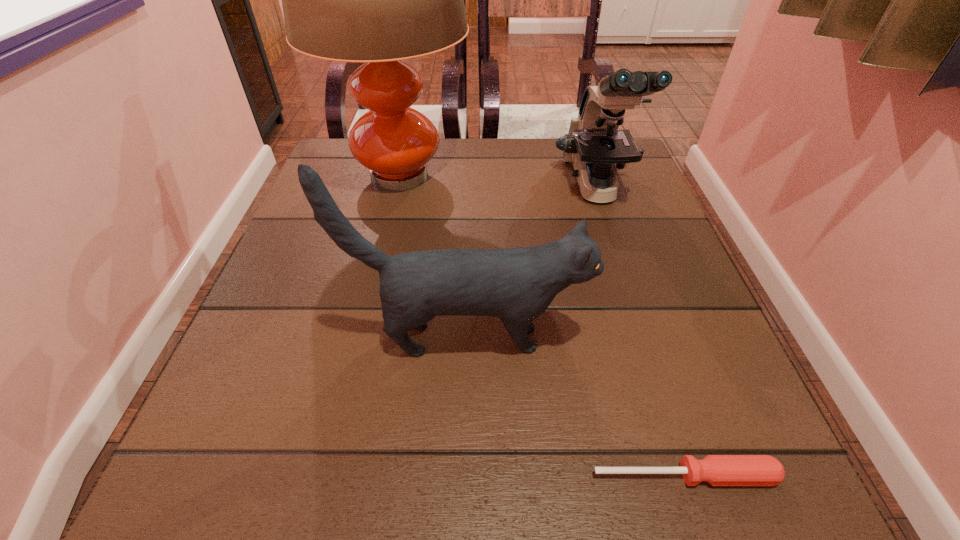
Where is `free space at the right edge of the desktop`? The image size is (960, 540). free space at the right edge of the desktop is located at coordinates (701, 338).

You are a GUI agent. You are given a task and a screenshot of the screen. Output one action in this format:
    pyautogui.click(x=<x>, y=<y>)
    Task: Click on the vacant area that lies between the shortest object and the microscope
    The width and height of the screenshot is (960, 540).
    Given the screenshot: What is the action you would take?
    pyautogui.click(x=640, y=332)

Locate an element on the screen. The width and height of the screenshot is (960, 540). vacant region between the microscope and the nearest object is located at coordinates point(640,332).

You are a GUI agent. You are given a task and a screenshot of the screen. Output one action in this format:
    pyautogui.click(x=<x>, y=<y>)
    Task: Click on the unoccupied position between the lamp and the shortest object
    The width and height of the screenshot is (960, 540).
    Given the screenshot: What is the action you would take?
    pyautogui.click(x=542, y=325)

Locate an element on the screen. The image size is (960, 540). empty space between the shortest object and the tallest object is located at coordinates (542, 325).

Identify the location of unoccupied area between the nearest object and the cat. (576, 407).

The image size is (960, 540). Identify the location of empty location between the third farthest object and the nearest object. (576, 407).

Where is `free space between the shortest object and the second nearest object`? free space between the shortest object and the second nearest object is located at coordinates (576, 407).

Identify which object is located as the second nearest to the microscope. Please provide its 2D coordinates. Your answer should be formatted as a tuple, i.e. [(x, y)], where the tuple contains the x and y coordinates of a point satisfying the conditions above.

[(518, 284)]

I want to click on object that ranks as the third closest to the third farthest object, so click(377, 0).